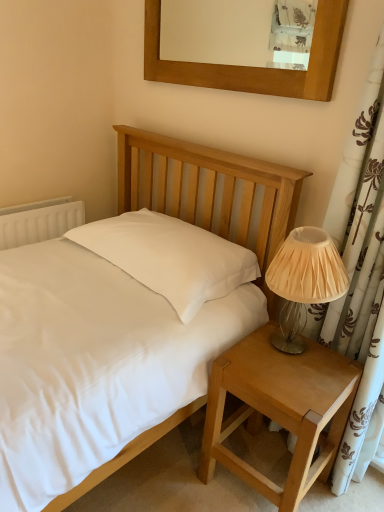
Question: Is white plastic radiator at left smaller than light brown wood nightstand at lower right?

Choices:
 (A) yes
 (B) no

Answer: (A)

Question: Considering the relative sizes of white plastic radiator at left and light brown wood nightstand at lower right in the image provided, is white plastic radiator at left bigger than light brown wood nightstand at lower right?

Choices:
 (A) no
 (B) yes

Answer: (A)

Question: Would you consider white plastic radiator at left to be distant from light brown wood nightstand at lower right?

Choices:
 (A) no
 (B) yes

Answer: (B)

Question: From the image's perspective, is white plastic radiator at left on top of light brown wood nightstand at lower right?

Choices:
 (A) yes
 (B) no

Answer: (A)

Question: Can you confirm if white plastic radiator at left is positioned to the right of light brown wood nightstand at lower right?

Choices:
 (A) no
 (B) yes

Answer: (A)

Question: Does point [x=254, y=388] appear closer or farther from the camera than point [x=251, y=241]?

Choices:
 (A) farther
 (B) closer

Answer: (B)

Question: From a real-world perspective, is light brown wood nightstand at lower right physically located above or below matte white bed at center?

Choices:
 (A) above
 (B) below

Answer: (B)

Question: Is light brown wood nightstand at lower right in front of or behind matte white bed at center in the image?

Choices:
 (A) front
 (B) behind

Answer: (B)

Question: In terms of size, does light brown wood nightstand at lower right appear bigger or smaller than matte white bed at center?

Choices:
 (A) big
 (B) small

Answer: (B)

Question: Considering their positions, is matte white bed at center located in front of or behind white plastic radiator at left?

Choices:
 (A) front
 (B) behind

Answer: (A)

Question: Considering the positions of point (254, 190) and point (6, 238), is point (254, 190) closer or farther from the camera than point (6, 238)?

Choices:
 (A) closer
 (B) farther

Answer: (A)

Question: Looking at their shapes, would you say matte white bed at center is wider or thinner than white plastic radiator at left?

Choices:
 (A) thin
 (B) wide

Answer: (B)

Question: In terms of size, does matte white bed at center appear bigger or smaller than white plastic radiator at left?

Choices:
 (A) big
 (B) small

Answer: (A)

Question: In terms of width, does wooden picture frame at upper center look wider or thinner when compared to matte white bed at center?

Choices:
 (A) thin
 (B) wide

Answer: (A)

Question: From a real-world perspective, is wooden picture frame at upper center positioned above or below matte white bed at center?

Choices:
 (A) above
 (B) below

Answer: (A)